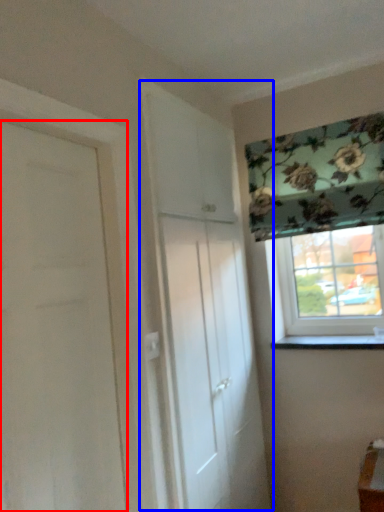
Question: Which object is further to the camera taking this photo, door (highlighted by a red box) or door (highlighted by a blue box)?

Choices:
 (A) door
 (B) door

Answer: (B)